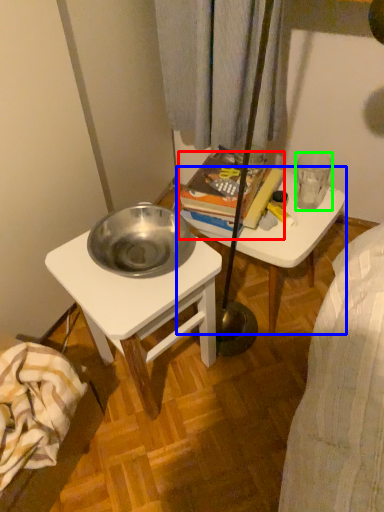
Question: Considering the real-world distances, which object is farthest from book (highlighted by a red box)? table (highlighted by a blue box) or coffee cup (highlighted by a green box)?

Choices:
 (A) table
 (B) coffee cup

Answer: (B)